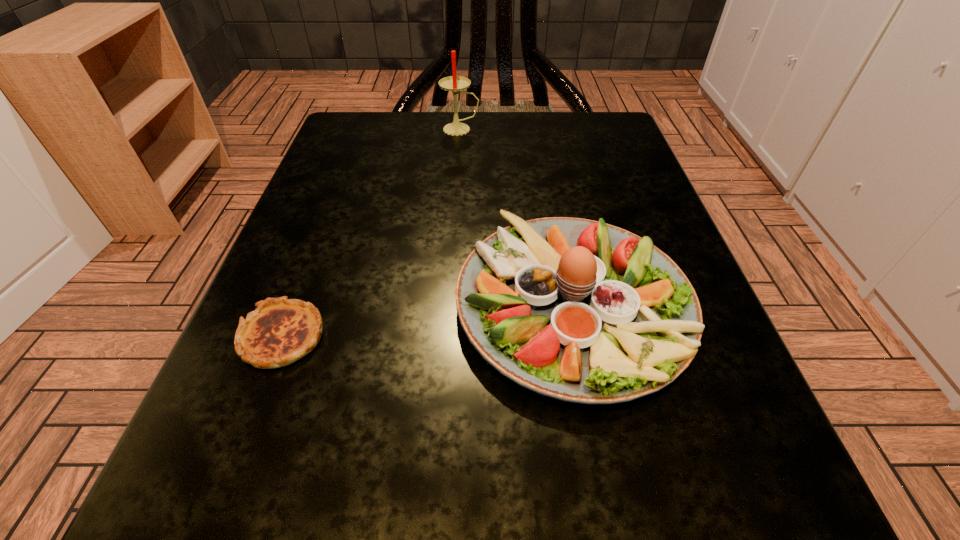
Image resolution: width=960 pixels, height=540 pixels. What are the coordinates of `object situated at the right edge` in the screenshot? It's located at (578, 310).

Where is `vacant space at the far edge of the desktop`? This screenshot has height=540, width=960. vacant space at the far edge of the desktop is located at coordinates (443, 123).

In the image, there is a desktop. Where is `vacant space at the near edge`? vacant space at the near edge is located at coordinates (457, 539).

Find the location of a particular element. free location at the left edge of the desktop is located at coordinates (303, 267).

This screenshot has width=960, height=540. In the image, there is a desktop. Identify the location of free space at the right edge. (665, 218).

This screenshot has height=540, width=960. I want to click on free space at the far left corner of the desktop, so click(359, 160).

Locate an element on the screen. The width and height of the screenshot is (960, 540). free space at the near left corner of the desktop is located at coordinates [202, 495].

In the image, there is a desktop. Where is `vacant region at the far right corner`? Image resolution: width=960 pixels, height=540 pixels. vacant region at the far right corner is located at coordinates (594, 143).

Identify the location of empty location between the quiche and the candle. (372, 233).

Identify the location of vacant region between the second shortest object and the shortest object. The height and width of the screenshot is (540, 960). (427, 321).